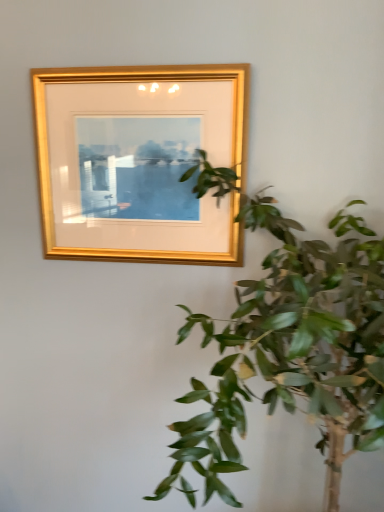
Question: Is green leafy plant at upper right in front of or behind gold wood picture frame at upper center in the image?

Choices:
 (A) behind
 (B) front

Answer: (B)

Question: Based on their sizes in the image, would you say green leafy plant at upper right is bigger or smaller than gold wood picture frame at upper center?

Choices:
 (A) big
 (B) small

Answer: (A)

Question: From a real-world perspective, is green leafy plant at upper right positioned above or below gold wood picture frame at upper center?

Choices:
 (A) above
 (B) below

Answer: (B)

Question: Is gold wood picture frame at upper center in front of or behind green leafy plant at upper right in the image?

Choices:
 (A) behind
 (B) front

Answer: (A)

Question: From a real-world perspective, is gold wood picture frame at upper center physically located above or below green leafy plant at upper right?

Choices:
 (A) above
 (B) below

Answer: (A)

Question: Based on their sizes in the image, would you say gold wood picture frame at upper center is bigger or smaller than green leafy plant at upper right?

Choices:
 (A) small
 (B) big

Answer: (A)

Question: Does point [x=233, y=76] appear closer or farther from the camera than point [x=289, y=412]?

Choices:
 (A) closer
 (B) farther

Answer: (B)